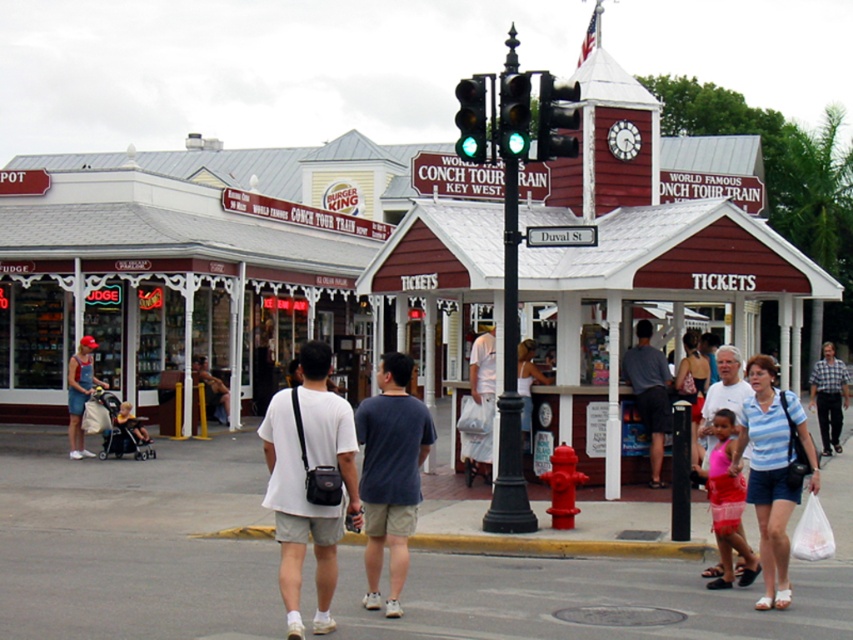
You are a photographer standing in the middle of the street. You want to take a photo of the pink fabric dress at lower right and the plaid shirt at center. Which object is positioned lower in the frame?

The pink fabric dress at lower right is positioned lower in the frame than the plaid shirt at center.

You are a photographer standing on the street and want to capture both the pink fabric dress at lower right and the plaid shirt at center in your shot. Which of the two objects should you focus on first to ensure they both fit in the frame?

The pink fabric dress at lower right has a lesser width compared to plaid shirt at center, so you should focus on the plaid shirt at center first to ensure both fit in the frame.